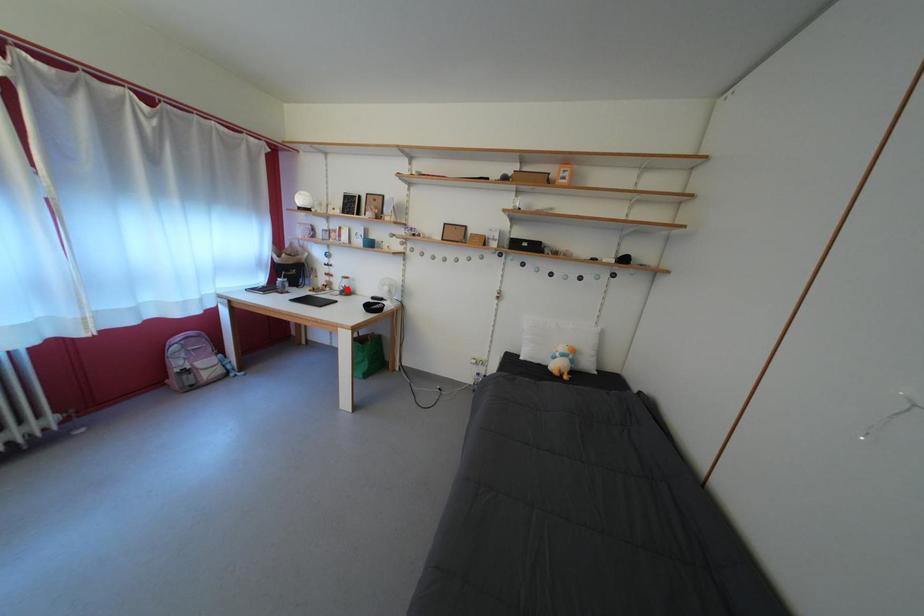
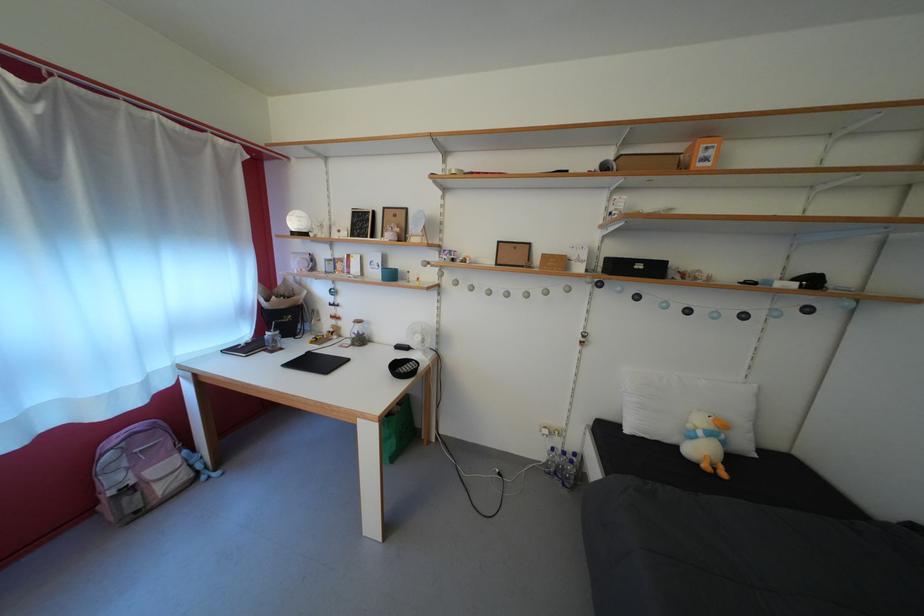
Find the pixel in the second image that matches the highlighted location in the first image.

(358, 334)